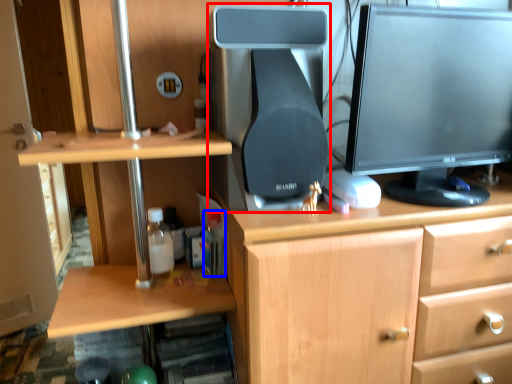
Question: Which point is closer to the camera, desktop computer (highlighted by a red box) or bottle (highlighted by a blue box)?

Choices:
 (A) desktop computer
 (B) bottle

Answer: (A)